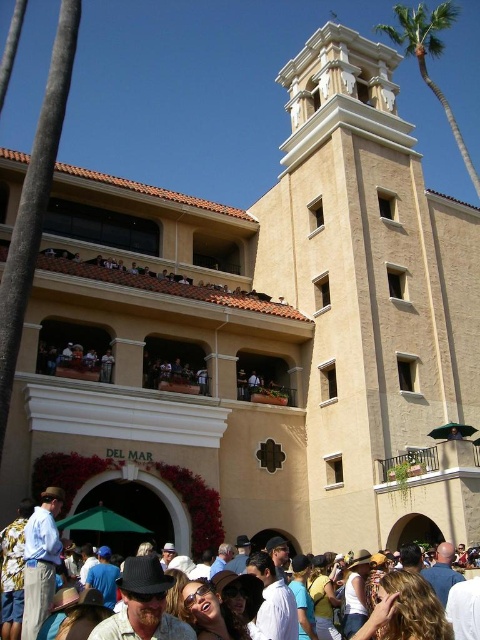
You are a tourist standing in front of the building with Spanish colonial architecture. You notice the multicolored fabric crowd at lower center and the green leafy palm tree at upper right. Which object is taller?

The multicolored fabric crowd at lower center is not as tall as the green leafy palm tree at upper right, so the green leafy palm tree at upper right is taller.

You are standing at the entrance of the building and want to take a photo of the point at coordinates point (396, 150). Can you capture it in your camera frame if your camera has a maximum focus range of 200 feet?

The distance of point (396, 150) from camera is 192.27 feet, which is within the camera maximum focus range of 200 feet. So yes, you can capture it in your camera frame.

You are standing in front of the building with Spanish colonial architecture. You notice a point marked at coordinates (x=372, y=296). Which architectural feature does this point indicate?

The point at coordinates (x=372, y=296) corresponds to the beige stucco bell tower at upper center.